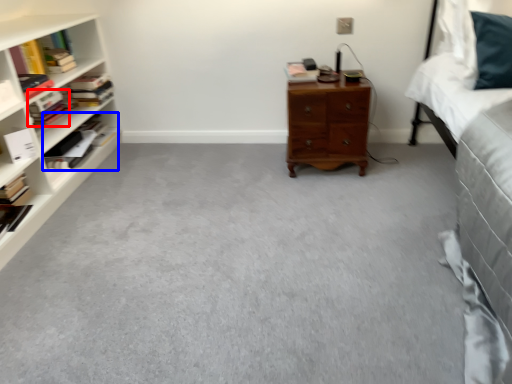
Question: Which of the following is the closest to the observer, book (highlighted by a red box) or book (highlighted by a blue box)?

Choices:
 (A) book
 (B) book

Answer: (A)